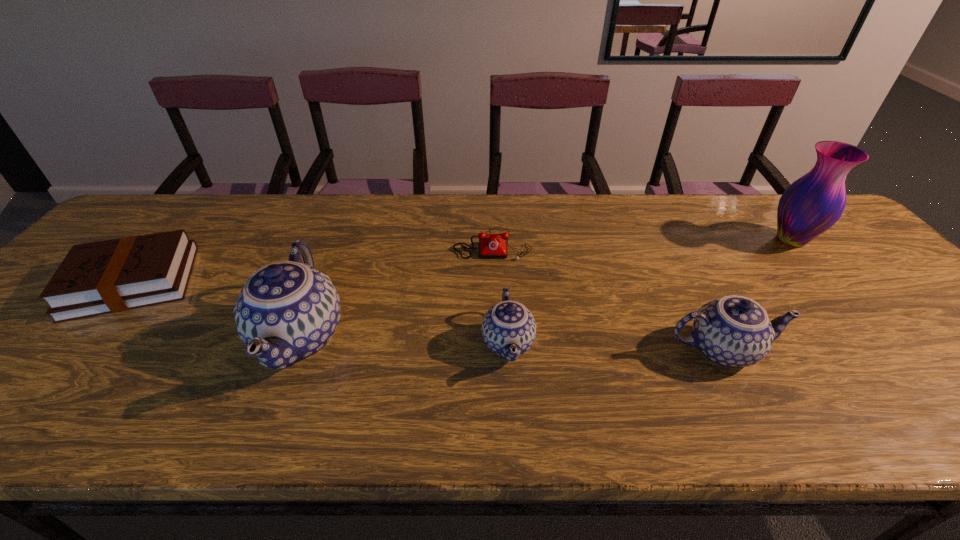
Locate an element on the screen. The height and width of the screenshot is (540, 960). the shortest object is located at coordinates (489, 247).

At what (x,y) coordinates should I click in order to perform the action: click on vacant area situated 0.350m from the spout of the rightmost chinaware. Please return your answer as a coordinate pair (x, y). The image size is (960, 540). Looking at the image, I should click on (937, 349).

This screenshot has height=540, width=960. I want to click on vacant region located 0.230m on the back of the leftmost object, so click(201, 203).

Image resolution: width=960 pixels, height=540 pixels. Find the location of `vacant space located 0.170m on the back of the vase`. vacant space located 0.170m on the back of the vase is located at coordinates point(753,195).

The image size is (960, 540). What are the coordinates of `vacant space situated on the dial of the shortest object` in the screenshot? It's located at (493, 274).

I want to click on vase that is at the far edge, so click(x=812, y=204).

I want to click on telephone present at the far edge, so [x=489, y=247].

The image size is (960, 540). Identify the location of object at the left edge. (110, 276).

Identify the location of object situated at the right edge. (812, 204).

Image resolution: width=960 pixels, height=540 pixels. I want to click on object present at the far right corner, so [x=812, y=204].